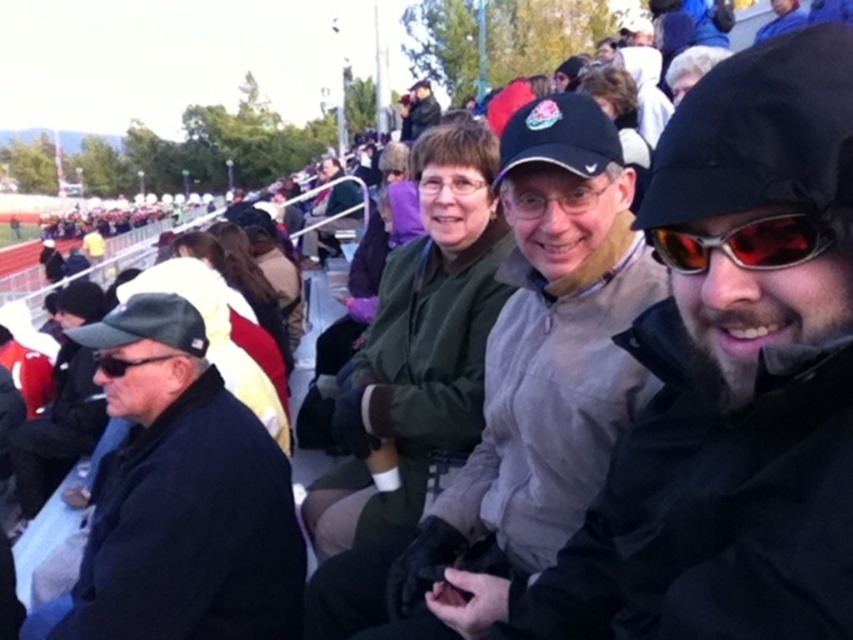
Based on the photo, you are a photographer at the event and want to capture both the matte black glasses at center and the black matte sunglasses at left in a single shot. Which object should you focus on first to ensure both are in frame?

You should focus on the matte black glasses at center first because it is above the black matte sunglasses at left, so adjusting the camera to include the upper object will naturally include the lower one as well.

You are a photographer trying to capture a candid shot of the crowd. You notice the gray fleece jacket at center and the black matte sunglasses at left. Which object would you need to focus on first if you want to ensure both are in the same frame without moving the camera?

The gray fleece jacket at center has a smaller size compared to black matte sunglasses at left, so you should focus on the smaller object first to ensure depth of field covers both.

You are a photographer standing at the center of the bleachers and want to take a picture of the gray fleece jacket at center. Based on its 2D coordinates, where should you aim your camera?

The gray fleece jacket at center is located at the 2D coordinates point [525,387], so you should aim your camera towards that specific coordinate point to capture it.